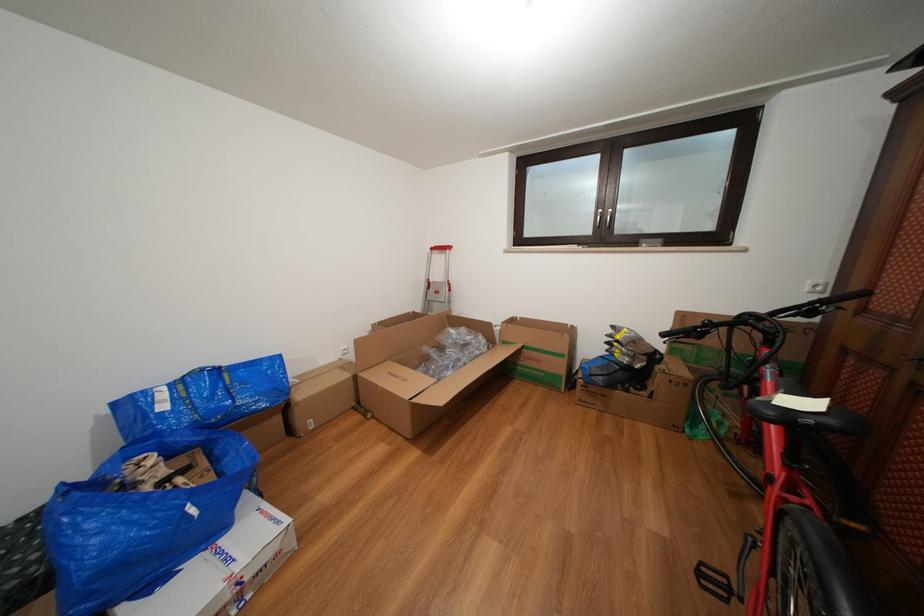
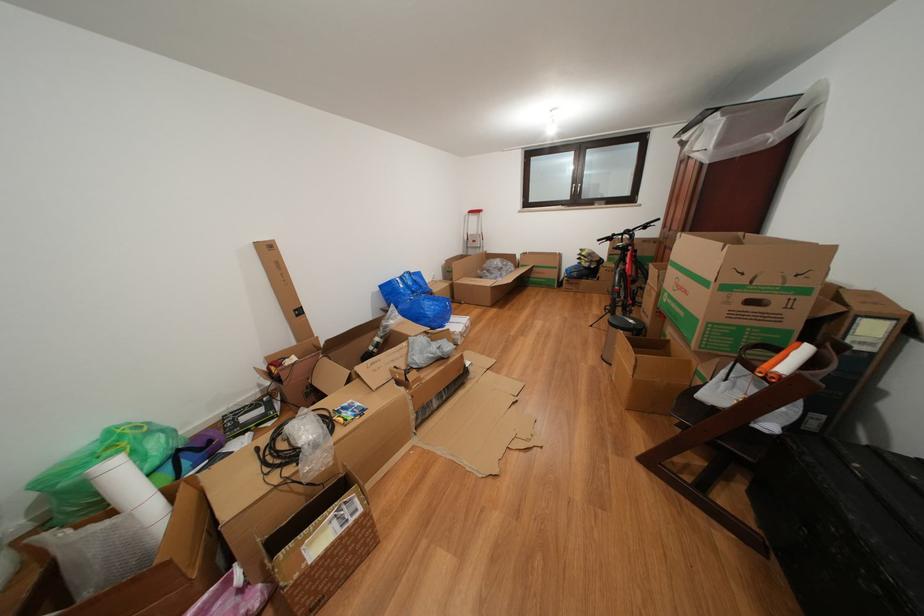
In the second image, find the point that corresponds to point 472,365 in the first image.

(513, 280)